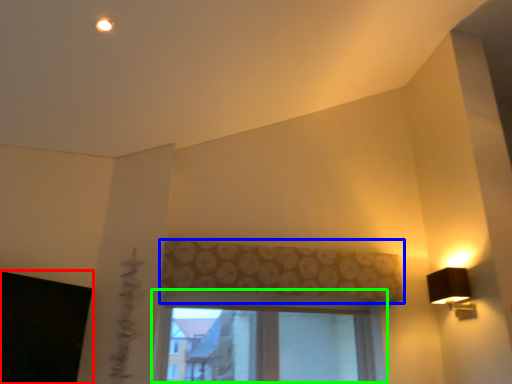
Question: Which is farther away from window screen (highlighted by a red box)? curtain (highlighted by a blue box) or window (highlighted by a green box)?

Choices:
 (A) curtain
 (B) window

Answer: (A)